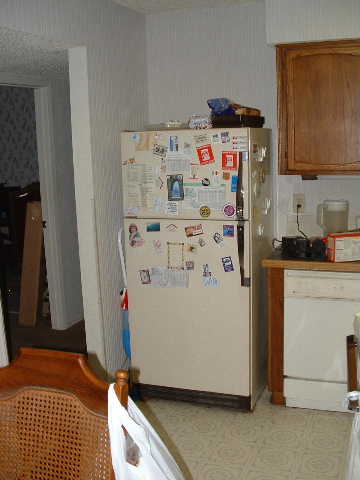
At what (x,y) coordinates should I click in order to perform the action: click on wallpapered wall. Please return your answer as a coordinate pair (x, y). Looking at the image, I should click on (17, 129).